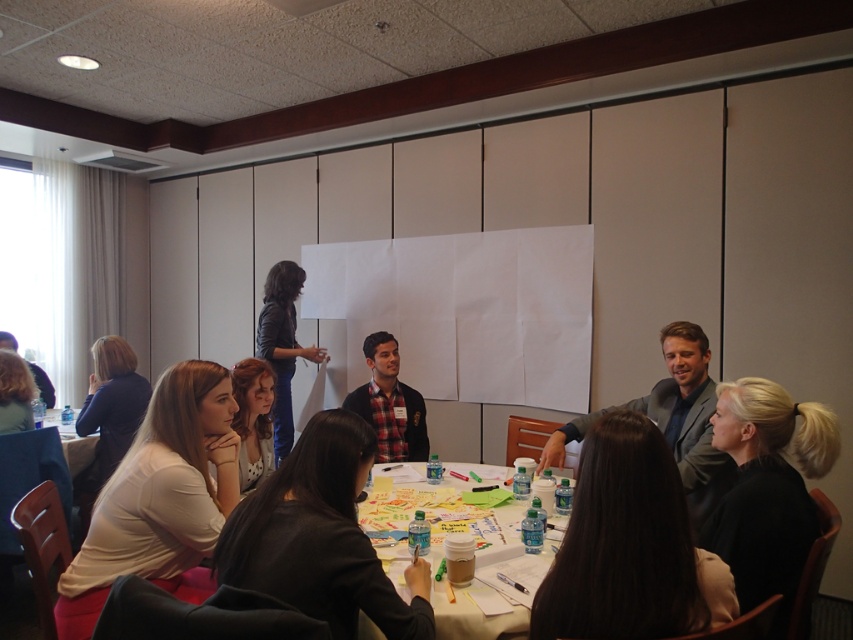
Which is behind, point (637, 481) or point (56, 410)?

Positioned behind is point (56, 410).

Is point (590, 440) farther from camera compared to point (44, 419)?

No, (590, 440) is closer to viewer.

Between point (648, 531) and point (82, 468), which one is positioned behind?

The point (82, 468) is more distant.

Locate an element on the screen. The width and height of the screenshot is (853, 640). dark brown hair at lower right is located at coordinates (630, 547).

Which is above, black leather jacket at upper center or white paper at center?

black leather jacket at upper center is higher up.

Is black leather jacket at upper center taller than white paper at center?

Indeed, black leather jacket at upper center has a greater height compared to white paper at center.

The height and width of the screenshot is (640, 853). I want to click on black leather jacket at upper center, so click(x=282, y=346).

Image resolution: width=853 pixels, height=640 pixels. What do you see at coordinates (160, 499) in the screenshot?
I see `white matte shirt at lower left` at bounding box center [160, 499].

Is white matte shirt at lower left taller than gray fabric suit at center?

Correct, white matte shirt at lower left is much taller as gray fabric suit at center.

Between point (196, 362) and point (694, 432), which one is positioned behind?

The point (694, 432) is more distant.

Where is `white matte shirt at lower left`? white matte shirt at lower left is located at coordinates [x=160, y=499].